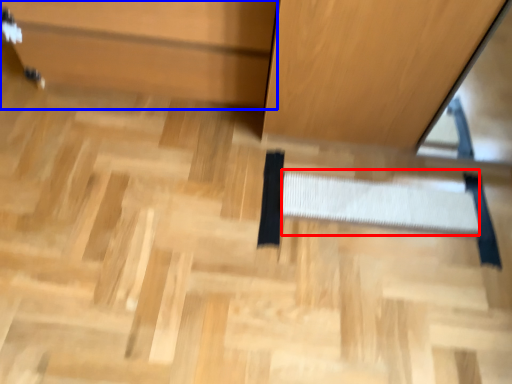
Question: Which object is closer to the camera taking this photo, stair (highlighted by a red box) or cabinetry (highlighted by a blue box)?

Choices:
 (A) stair
 (B) cabinetry

Answer: (B)